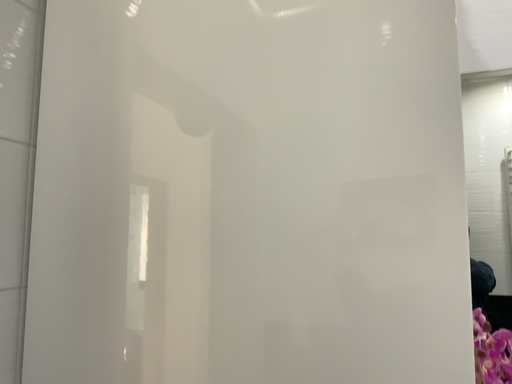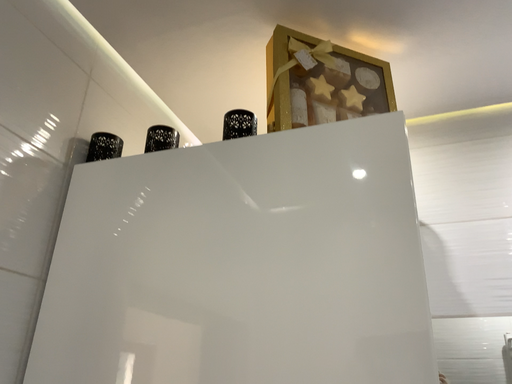
Question: Which way did the camera rotate in the video?

Choices:
 (A) rotated downward
 (B) rotated upward

Answer: (B)